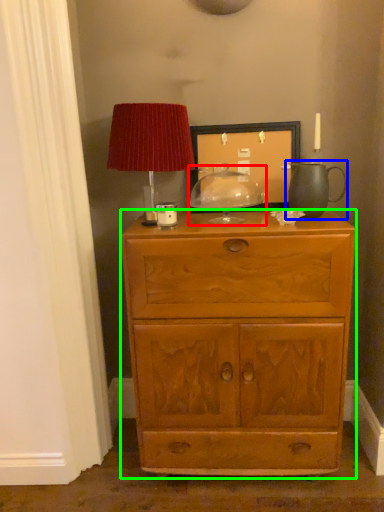
Question: Considering the real-world distances, which object is farthest from candle holder (highlighted by a red box)? tea pot (highlighted by a blue box) or chest of drawers (highlighted by a green box)?

Choices:
 (A) tea pot
 (B) chest of drawers

Answer: (B)